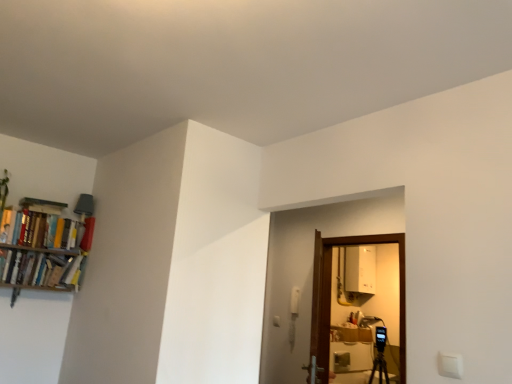
Question: Is matte red book at upper left, which appears as the second book when ordered from the bottom, at the back of hardcover books at left, which is the 1th book in bottom-to-top order?

Choices:
 (A) yes
 (B) no

Answer: (B)

Question: Is hardcover books at left, which appears as the third book when viewed from the top, wider than matte red book at upper left, which appears as the second book when ordered from the bottom?

Choices:
 (A) yes
 (B) no

Answer: (A)

Question: From a real-world perspective, does hardcover books at left, which appears as the third book when viewed from the top, sit lower than matte red book at upper left, which is counted as the 2th book, starting from the top?

Choices:
 (A) yes
 (B) no

Answer: (A)

Question: Does hardcover books at left, which appears as the third book when viewed from the top, have a larger size compared to matte red book at upper left, which is counted as the 2th book, starting from the top?

Choices:
 (A) no
 (B) yes

Answer: (B)

Question: Is hardcover books at left, which appears as the third book when viewed from the top, at the left side of matte red book at upper left, which appears as the second book when ordered from the bottom?

Choices:
 (A) yes
 (B) no

Answer: (A)

Question: Considering the positions of matte red book at upper left, which appears as the second book when ordered from the bottom, and hardcover books at left, which ranks as the 3th book in bottom-to-top order, in the image, is matte red book at upper left, which appears as the second book when ordered from the bottom, wider or thinner than hardcover books at left, which ranks as the 3th book in bottom-to-top order,?

Choices:
 (A) wide
 (B) thin

Answer: (B)

Question: Considering the positions of point (86, 221) and point (66, 220), is point (86, 221) closer or farther from the camera than point (66, 220)?

Choices:
 (A) closer
 (B) farther

Answer: (A)

Question: From a real-world perspective, is matte red book at upper left, which appears as the second book when ordered from the bottom, above or below hardcover books at left, which is the 1th book from top to bottom?

Choices:
 (A) below
 (B) above

Answer: (B)

Question: From the image's perspective, is matte red book at upper left, which is counted as the 2th book, starting from the top, located above or below hardcover books at left, which ranks as the 3th book in bottom-to-top order?

Choices:
 (A) below
 (B) above

Answer: (A)

Question: From a real-world perspective, is matte red book at upper left, which appears as the second book when ordered from the bottom, above or below hardcover books at left, which appears as the third book when viewed from the top?

Choices:
 (A) above
 (B) below

Answer: (A)

Question: Is matte red book at upper left, which appears as the second book when ordered from the bottom, bigger or smaller than hardcover books at left, which is the 1th book in bottom-to-top order?

Choices:
 (A) small
 (B) big

Answer: (A)

Question: From their relative heights in the image, would you say matte red book at upper left, which appears as the second book when ordered from the bottom, is taller or shorter than hardcover books at left, which is the 1th book in bottom-to-top order?

Choices:
 (A) tall
 (B) short

Answer: (A)

Question: Is matte red book at upper left, which is counted as the 2th book, starting from the top, situated inside hardcover books at left, which appears as the third book when viewed from the top, or outside?

Choices:
 (A) outside
 (B) inside

Answer: (A)

Question: Choose the correct answer: Is hardcover books at left, which is the 1th book from top to bottom, inside matte red book at upper left, which is counted as the 2th book, starting from the top, or outside it?

Choices:
 (A) inside
 (B) outside

Answer: (B)

Question: Is hardcover books at left, which ranks as the 3th book in bottom-to-top order, taller or shorter than matte red book at upper left, which is counted as the 2th book, starting from the top?

Choices:
 (A) short
 (B) tall

Answer: (B)